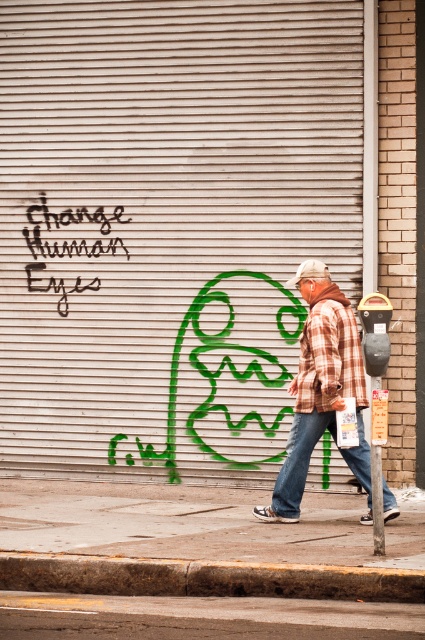
Question: Observing the image, what is the correct spatial positioning of gray concrete sidewalk at lower center in reference to denim at center?

Choices:
 (A) below
 (B) above

Answer: (A)

Question: Does wooden textured garage door at center have a larger size compared to denim at center?

Choices:
 (A) no
 (B) yes

Answer: (B)

Question: Which point is farther to the camera?

Choices:
 (A) (376, 378)
 (B) (348, 348)
 (C) (84, 208)

Answer: (C)

Question: Is plaid fabric jacket at center behind black graffiti at upper left?

Choices:
 (A) yes
 (B) no

Answer: (B)

Question: Which is farther from the gray concrete sidewalk at lower center?

Choices:
 (A) denim at center
 (B) plaid flannel shirt at center
 (C) black graffiti at upper left

Answer: (C)

Question: Which of the following is the farthest from the observer?

Choices:
 (A) wooden textured garage door at center
 (B) plaid fabric jacket at center
 (C) black plastic parking meter at right

Answer: (A)